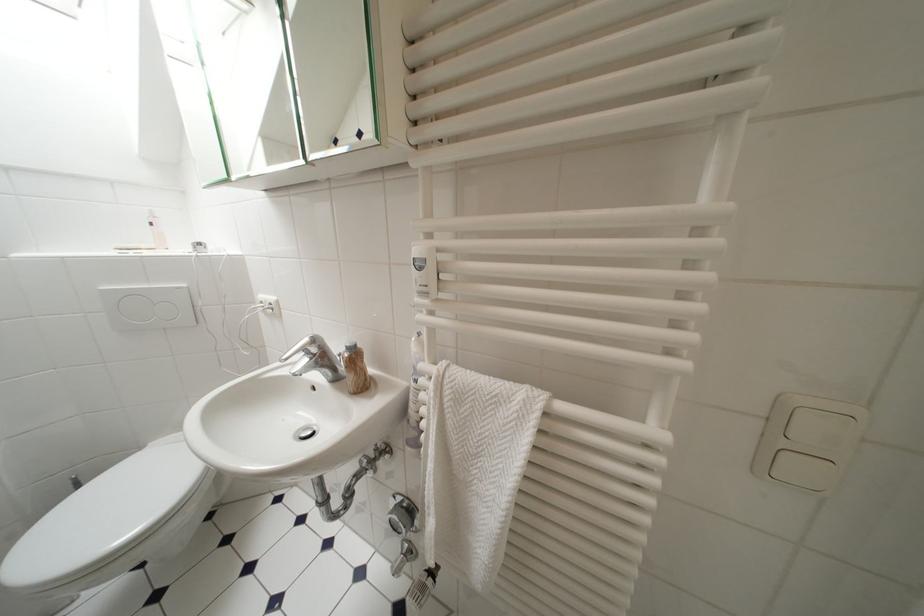
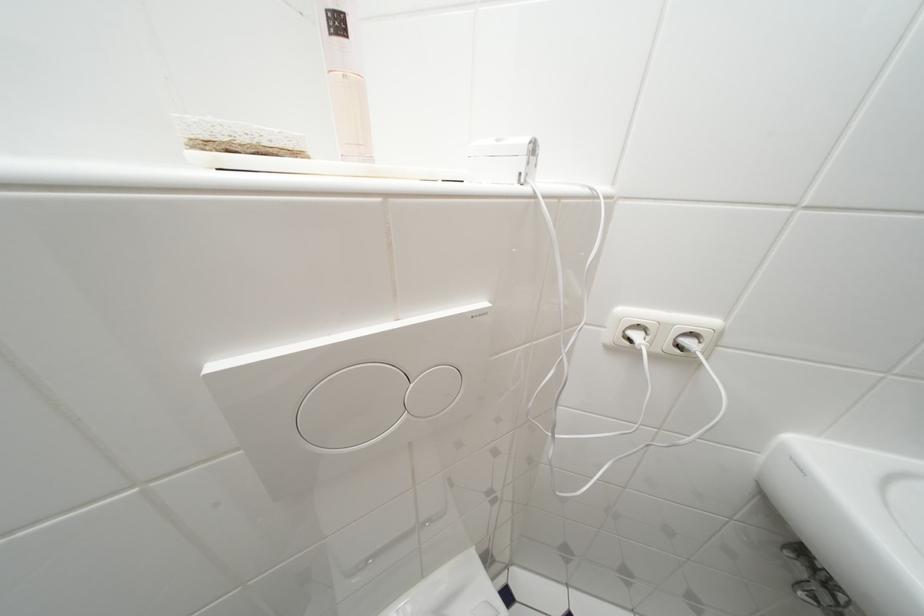
Where in the second image is the point corresponding to [159,227] from the first image?

(345, 26)